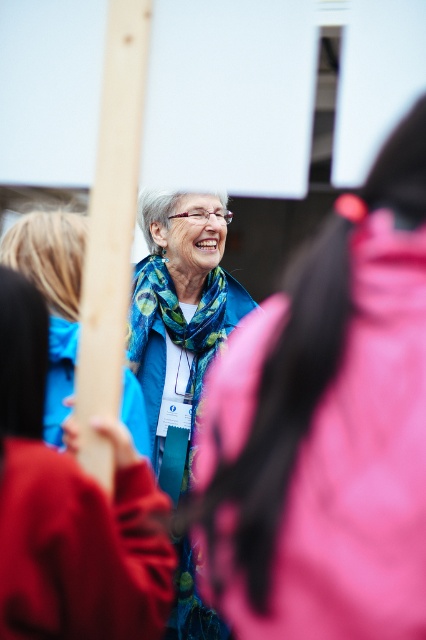
Question: Is blue fabric jacket at center to the left of matte blue scarf at center from the viewer's perspective?

Choices:
 (A) yes
 (B) no

Answer: (B)

Question: Which object is closer to the camera taking this photo?

Choices:
 (A) blue fabric jacket at center
 (B) matte blue scarf at center

Answer: (A)

Question: Which point is farther from the camera taking this photo?

Choices:
 (A) (242, 573)
 (B) (137, 332)

Answer: (B)

Question: Is blue fabric jacket at center positioned before matte blue scarf at center?

Choices:
 (A) yes
 (B) no

Answer: (A)

Question: Does blue fabric jacket at center appear on the left side of matte blue scarf at center?

Choices:
 (A) yes
 (B) no

Answer: (B)